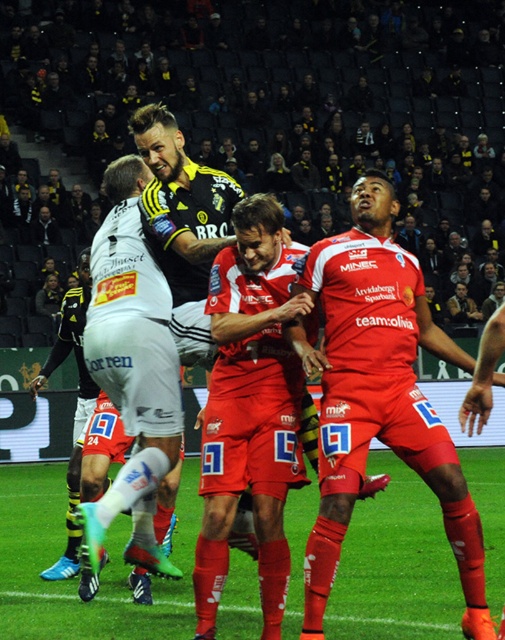
Between green grass football field at center and black jersey at center, which one is positioned lower?

green grass football field at center

Between green grass football field at center and black jersey at center, which one has more height?

Standing taller between the two is black jersey at center.

Is point (438, 564) less distant than point (179, 172)?

That is False.

Where is `green grass football field at center`? Image resolution: width=505 pixels, height=640 pixels. green grass football field at center is located at coordinates (76, 577).

Is red matte soccer player at center positioned behind matte red shorts at center?

No, red matte soccer player at center is in front of matte red shorts at center.

Who is positioned more to the right, red matte soccer player at center or matte red shorts at center?

From the viewer's perspective, red matte soccer player at center appears more on the right side.

This screenshot has height=640, width=505. In order to click on red matte soccer player at center in this screenshot , I will do `click(380, 394)`.

You are a GUI agent. You are given a task and a screenshot of the screen. Output one action in this format:
    pyautogui.click(x=<x>, y=<y>)
    Task: Click on the red matte soccer player at center
    The height and width of the screenshot is (640, 505).
    Given the screenshot: What is the action you would take?
    pyautogui.click(x=380, y=394)

Does green grass football field at center have a lesser height compared to red matte soccer player at center?

Correct, green grass football field at center is not as tall as red matte soccer player at center.

Consider the image. Can you confirm if green grass football field at center is thinner than red matte soccer player at center?

No.

Who is more distant from viewer, (44, 486) or (329, 340)?

The point (44, 486) is behind.

You are a GUI agent. You are given a task and a screenshot of the screen. Output one action in this format:
    pyautogui.click(x=<x>, y=<y>)
    Task: Click on the green grass football field at center
    
    Given the screenshot: What is the action you would take?
    pyautogui.click(x=76, y=577)